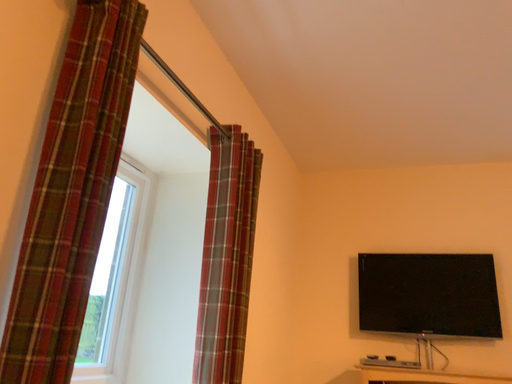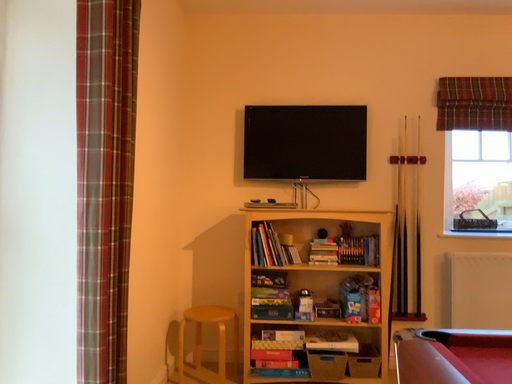
Question: How did the camera likely rotate when shooting the video?

Choices:
 (A) rotated downward
 (B) rotated upward

Answer: (A)